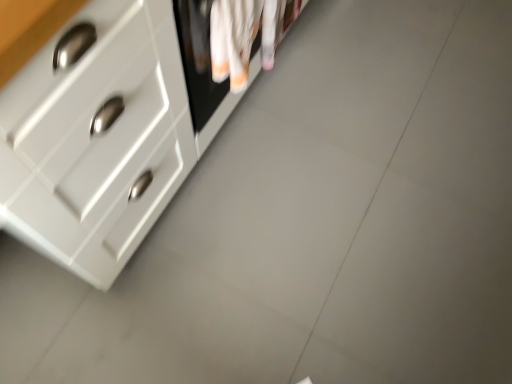
Question: Considering the positions of white cotton laundry at upper center and white glossy chest of drawers at upper left in the image, is white cotton laundry at upper center wider or thinner than white glossy chest of drawers at upper left?

Choices:
 (A) thin
 (B) wide

Answer: (A)

Question: From the image's perspective, is white cotton laundry at upper center above or below white glossy chest of drawers at upper left?

Choices:
 (A) above
 (B) below

Answer: (B)

Question: Is point (267, 39) positioned closer to the camera than point (76, 82)?

Choices:
 (A) closer
 (B) farther

Answer: (B)

Question: In terms of height, does white glossy chest of drawers at upper left look taller or shorter compared to white cotton laundry at upper center?

Choices:
 (A) short
 (B) tall

Answer: (B)

Question: Is white glossy chest of drawers at upper left inside the boundaries of white cotton laundry at upper center, or outside?

Choices:
 (A) outside
 (B) inside

Answer: (A)

Question: From a real-world perspective, relative to white cotton laundry at upper center, is white glossy chest of drawers at upper left vertically above or below?

Choices:
 (A) above
 (B) below

Answer: (B)

Question: Looking at the image, does white glossy chest of drawers at upper left seem bigger or smaller compared to white cotton laundry at upper center?

Choices:
 (A) big
 (B) small

Answer: (A)